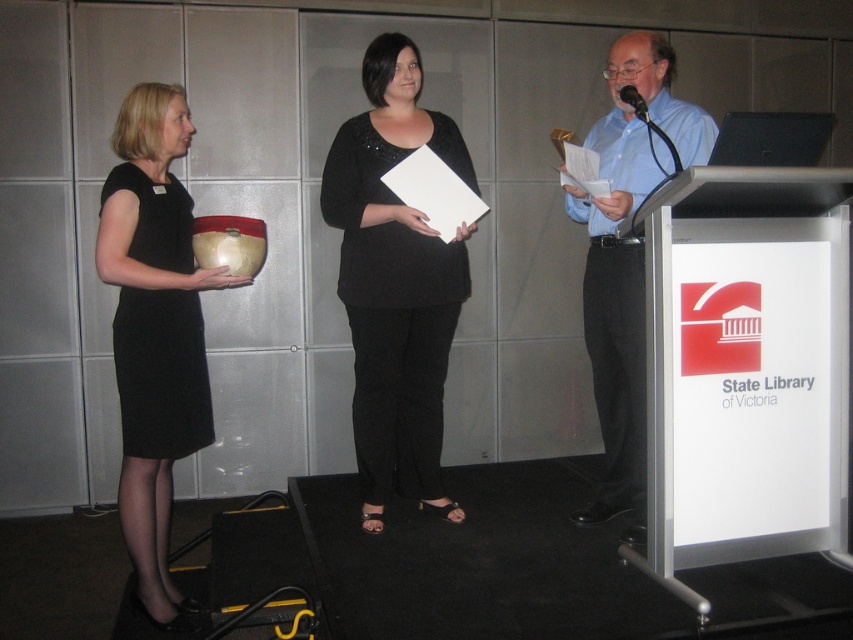
Describe the element at coordinates (396, 282) in the screenshot. I see `black matte dress at center` at that location.

Who is more distant from viewer, (386, 451) or (631, 84)?

The point (386, 451) is more distant.

What are the coordinates of `black matte dress at center` in the screenshot? It's located at (396, 282).

Who is lower down, black matte dress at center or blue shirt at right?

Positioned lower is blue shirt at right.

Looking at this image, is black matte dress at center to the right of blue shirt at right from the viewer's perspective?

Incorrect, black matte dress at center is not on the right side of blue shirt at right.

Does point (351, 196) come farther from viewer compared to point (663, 60)?

Yes.

The height and width of the screenshot is (640, 853). I want to click on black matte dress at center, so click(x=396, y=282).

Does matte black dress at left appear over black plastic microphone at upper right?

No, matte black dress at left is not above black plastic microphone at upper right.

Is matte black dress at left further to camera compared to black plastic microphone at upper right?

No, matte black dress at left is closer to the viewer.

Is point (149, 140) behind point (642, 115)?

Yes.

This screenshot has height=640, width=853. Find the location of `matte black dress at left`. matte black dress at left is located at coordinates (154, 332).